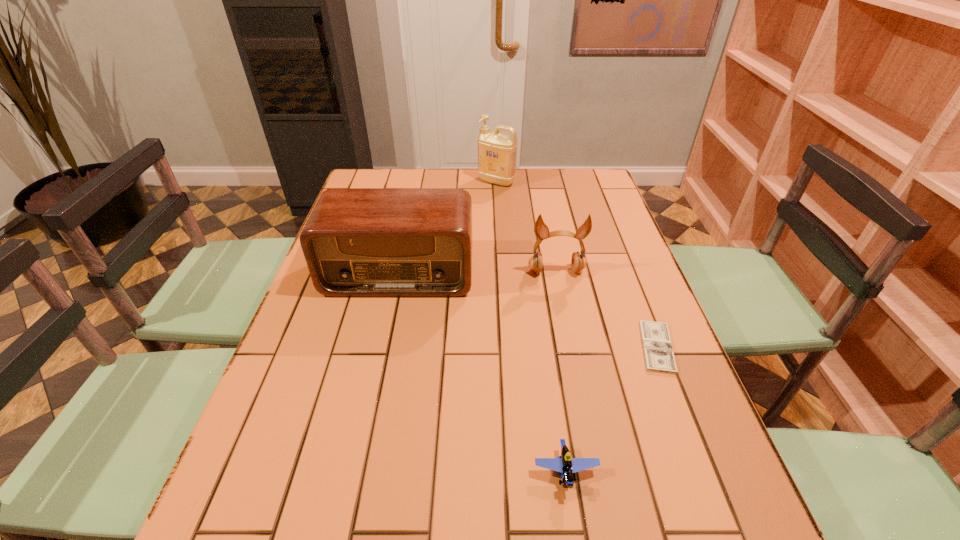
Locate an element on the screen. The height and width of the screenshot is (540, 960). free space located 0.240m on the front of the dollar is located at coordinates (710, 485).

Image resolution: width=960 pixels, height=540 pixels. I want to click on object at the far edge, so 497,152.

At what (x,y) coordinates should I click in order to perform the action: click on object that is positioned at the left edge. Please return your answer as a coordinate pair (x, y). The width and height of the screenshot is (960, 540). Looking at the image, I should click on point(358,242).

You are a GUI agent. You are given a task and a screenshot of the screen. Output one action in this format:
    pyautogui.click(x=<x>, y=<y>)
    Task: Click on the earphone at the right edge
    The image size is (960, 540).
    Given the screenshot: What is the action you would take?
    [x=578, y=262]

Where is `dollar at the right edge`? dollar at the right edge is located at coordinates (658, 353).

Where is `vacant area at the far edge`? vacant area at the far edge is located at coordinates (519, 186).

Locate an element on the screen. The image size is (960, 540). vacant space at the left edge of the desktop is located at coordinates (248, 453).

In the image, there is a desktop. Where is `vacant space at the right edge`? The height and width of the screenshot is (540, 960). vacant space at the right edge is located at coordinates (625, 291).

In the image, there is a desktop. Where is `vacant space at the far right corner`? This screenshot has height=540, width=960. vacant space at the far right corner is located at coordinates (596, 201).

The height and width of the screenshot is (540, 960). What are the coordinates of `vacant area that lies between the earphone and the farthest object` in the screenshot? It's located at (526, 226).